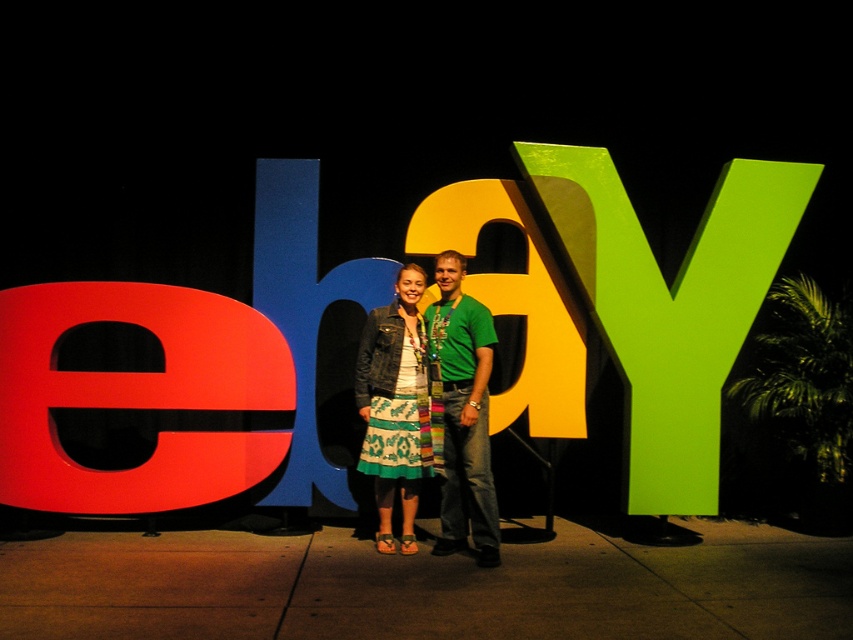
You are a photographer trying to capture a photo of the green textured shirt at center and the matte yellow letter at center. Which object will appear bigger in your photo?

The green textured shirt at center will appear bigger in the photo because it is larger in size than the matte yellow letter at center.

You are a photographer trying to capture the eBay letters in the scene. You notice the green glossy y at center right and the matte yellow letter at center. Which letter should you focus on if you want to highlight the larger one in your photo?

The green glossy y at center right is larger than the matte yellow letter at center, so you should focus on the green glossy y at center right to highlight the larger one in your photo.